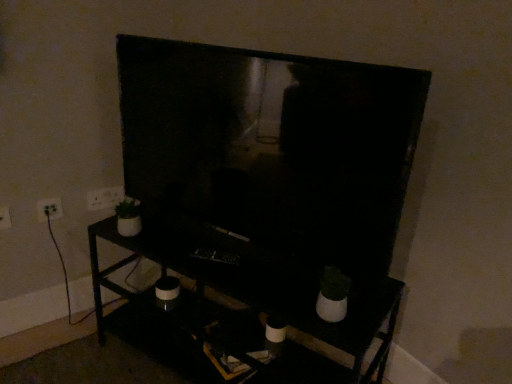
Question: From the image's perspective, is white plastic electric outlet at left, acting as the 3th electric outlet starting from the back, over white plastic electric outlet at upper left, the first electric outlet in the back-to-front sequence?

Choices:
 (A) no
 (B) yes

Answer: (A)

Question: From a real-world perspective, is white plastic electric outlet at left, acting as the first electric outlet starting from the left, positioned under white plastic electric outlet at upper left, which appears as the 3th electric outlet when viewed from the left, based on gravity?

Choices:
 (A) no
 (B) yes

Answer: (B)

Question: Is white plastic electric outlet at left, acting as the first electric outlet starting from the left, positioned beyond the bounds of white plastic electric outlet at upper left, the first electric outlet in the back-to-front sequence?

Choices:
 (A) yes
 (B) no

Answer: (A)

Question: Is white plastic electric outlet at left, acting as the first electric outlet starting from the left, smaller than white plastic electric outlet at upper left, which appears as the 3th electric outlet when viewed from the left?

Choices:
 (A) yes
 (B) no

Answer: (A)

Question: From a real-world perspective, is white plastic electric outlet at left, acting as the 3th electric outlet starting from the back, positioned over white plastic electric outlet at upper left, the first electric outlet in the back-to-front sequence, based on gravity?

Choices:
 (A) no
 (B) yes

Answer: (A)

Question: From the image's perspective, is white plastic electric outlet at left, acting as the 3th electric outlet starting from the back, positioned above or below white plastic electric outlet at upper left, the first electric outlet in the back-to-front sequence?

Choices:
 (A) below
 (B) above

Answer: (A)

Question: In terms of width, does white plastic electric outlet at left, acting as the 3th electric outlet starting from the back, look wider or thinner when compared to white plastic electric outlet at upper left, the first electric outlet in the back-to-front sequence?

Choices:
 (A) wide
 (B) thin

Answer: (A)

Question: Considering their positions, is white plastic electric outlet at left, acting as the 3th electric outlet starting from the back, located in front of or behind white plastic electric outlet at upper left, the first electric outlet in the back-to-front sequence?

Choices:
 (A) front
 (B) behind

Answer: (A)

Question: From a real-world perspective, is white plastic electric outlet at left, acting as the 3th electric outlet starting from the back, above or below white plastic electric outlet at upper left, marked as the 3th electric outlet in a front-to-back arrangement?

Choices:
 (A) above
 (B) below

Answer: (B)

Question: Looking at the image, does white plastic electric outlet at left, the third electric outlet positioned from the right, seem bigger or smaller compared to white plastic electric outlet at left, positioned as the second electric outlet in front-to-back order?

Choices:
 (A) small
 (B) big

Answer: (B)

Question: Looking at their shapes, would you say white plastic electric outlet at left, the third electric outlet positioned from the right, is wider or thinner than white plastic electric outlet at left, which is the 2th electric outlet in back-to-front order?

Choices:
 (A) thin
 (B) wide

Answer: (A)

Question: In terms of height, does white plastic electric outlet at left, acting as the first electric outlet starting from the left, look taller or shorter compared to white plastic electric outlet at left, marked as the second electric outlet in a right-to-left arrangement?

Choices:
 (A) short
 (B) tall

Answer: (B)

Question: From the image's perspective, is white plastic electric outlet at left, the third electric outlet positioned from the right, located above or below white plastic electric outlet at left, positioned as the second electric outlet in front-to-back order?

Choices:
 (A) below
 (B) above

Answer: (A)

Question: Considering the positions of white plastic electric outlet at upper left, the 1th electric outlet viewed from the right, and white plastic electric outlet at left, acting as the 3th electric outlet starting from the back, in the image, is white plastic electric outlet at upper left, the 1th electric outlet viewed from the right, bigger or smaller than white plastic electric outlet at left, acting as the 3th electric outlet starting from the back,?

Choices:
 (A) small
 (B) big

Answer: (B)

Question: Is point (117, 195) closer or farther from the camera than point (10, 221)?

Choices:
 (A) farther
 (B) closer

Answer: (A)